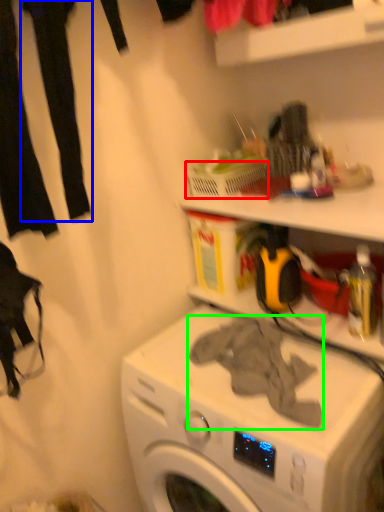
Question: Which object is the closest to the basket (highlighted by a red box)? Choose among these: clothing (highlighted by a blue box) or clothing (highlighted by a green box).

Choices:
 (A) clothing
 (B) clothing

Answer: (B)